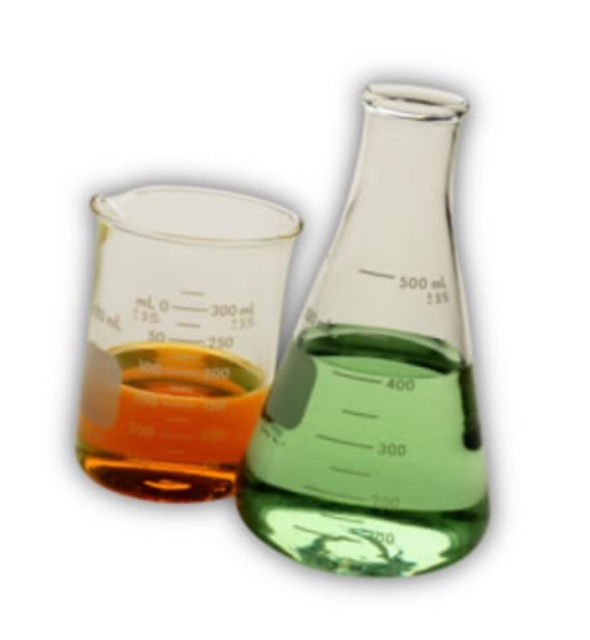
You are a lab assistant who needs to pour a solution from the transparent glass beaker at center into the translucent glass beaker at left. Will the solution fit without spilling?

The transparent glass beaker at center has a larger width than the translucent glass beaker at left, so pouring the solution from the wider beaker into the narrower one may cause spills due to the difference in width. Ensure the volume of the solution is less than the capacity of the translucent glass beaker at left to prevent overflow.

You are a lab technician who needs to pour a chemical solution from the transparent glass beaker at center into the translucent glass beaker at left. Which beaker should you hold first to ensure proper pouring?

You should hold the transparent glass beaker at center first because it is closer to the viewer, making it easier to access and pour into the translucent glass beaker at left.